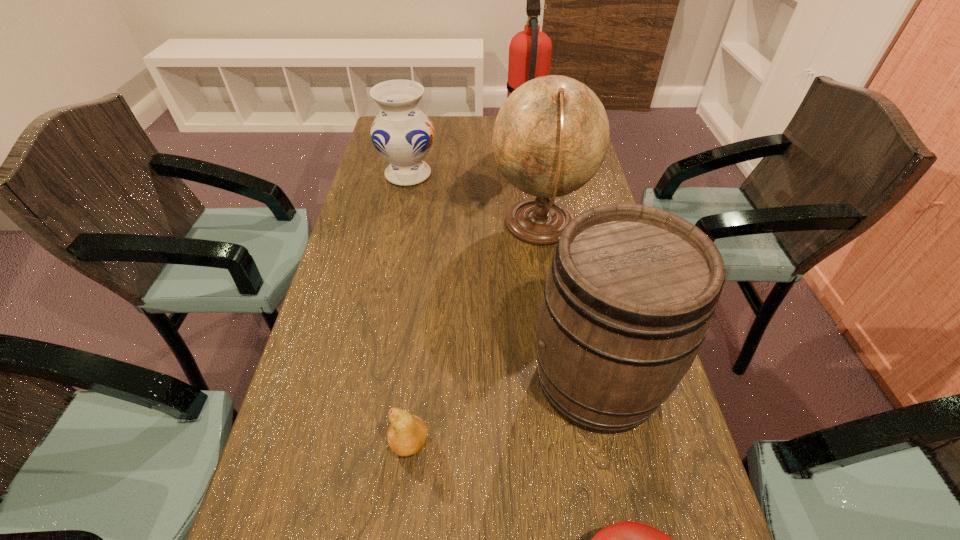
The width and height of the screenshot is (960, 540). I want to click on fire extinguisher, so click(530, 50).

Image resolution: width=960 pixels, height=540 pixels. I want to click on globe, so click(550, 137).

The height and width of the screenshot is (540, 960). Find the location of `wine bucket`. wine bucket is located at coordinates (628, 300).

At what (x,y) coordinates should I click in order to perform the action: click on the fourth tallest object. Please return your answer as a coordinate pair (x, y). Image resolution: width=960 pixels, height=540 pixels. Looking at the image, I should click on (403, 135).

Where is `the fifth tallest object`? This screenshot has height=540, width=960. the fifth tallest object is located at coordinates (407, 434).

Where is `vacant space situated 0.280m at the nozzle of the fire extinguisher`? The width and height of the screenshot is (960, 540). vacant space situated 0.280m at the nozzle of the fire extinguisher is located at coordinates (425, 145).

Find the location of a particular element. This screenshot has height=540, width=960. free space located at the nozzle of the fire extinguisher is located at coordinates pos(422,145).

The image size is (960, 540). Find the location of `vacant space located at the nozzle of the fire extinguisher`. vacant space located at the nozzle of the fire extinguisher is located at coordinates (482, 145).

Where is `vacant space located 0.230m on the front-facing side of the fourth nearest object`? This screenshot has height=540, width=960. vacant space located 0.230m on the front-facing side of the fourth nearest object is located at coordinates (410, 226).

This screenshot has height=540, width=960. I want to click on free location located on the front-facing side of the fourth nearest object, so click(x=423, y=226).